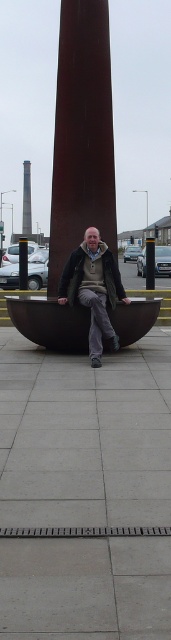
You are standing at point A located at coordinates 0.1, 0.5. You want to walk to the rustic metal sculpture at center. Which direction should you move in to reach it?

You should move to the right to reach the rustic metal sculpture at center because it is located at point (x=82, y=134), which is to the right of your current position at (x=85, y=64).

You are standing in the urban scene and want to place a small flag at the closest point between point (90, 61) and point (100, 337). Which point should you choose?

Point (100, 337) is closer to the camera than point (90, 61), so you should place the flag at point (100, 337).

You are an urban planner assessing the space between the rustic metal sculpture at center and the smooth brown tower at center. Which structure has a smaller width when viewed from above?

The rustic metal sculpture at center is thinner than the smooth brown tower at center, so it has a smaller width when viewed from above.